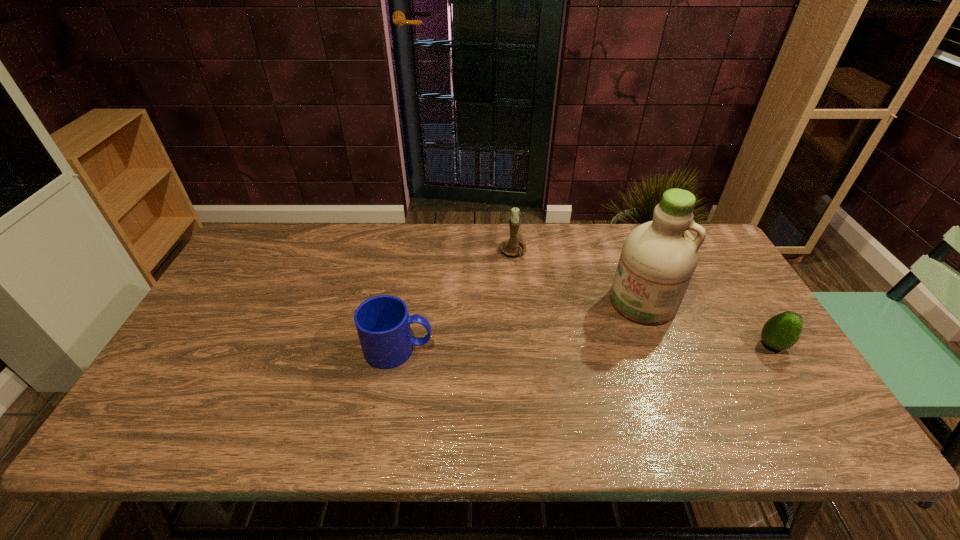
Where is `vacant space located 0.340m on the side of the candle holder with the handle`? The width and height of the screenshot is (960, 540). vacant space located 0.340m on the side of the candle holder with the handle is located at coordinates [x=552, y=344].

You are a GUI agent. You are given a task and a screenshot of the screen. Output one action in this format:
    pyautogui.click(x=<x>, y=<y>)
    Task: Click on the vacant area located on the front label of the tallest object
    The image size is (960, 540).
    Given the screenshot: What is the action you would take?
    pyautogui.click(x=588, y=371)

Find the location of `free spot located on the front label of the tallest object`. free spot located on the front label of the tallest object is located at coordinates (584, 376).

Where is `free spot located 0.140m on the front label of the tallest object`? Image resolution: width=960 pixels, height=540 pixels. free spot located 0.140m on the front label of the tallest object is located at coordinates (604, 352).

Locate an element on the screen. The height and width of the screenshot is (540, 960). object located at the far edge is located at coordinates (511, 247).

The height and width of the screenshot is (540, 960). I want to click on object that is positioned at the right edge, so point(782,331).

Where is `vacant space at the far edge of the desktop`? The image size is (960, 540). vacant space at the far edge of the desktop is located at coordinates (398, 226).

You are a GUI agent. You are given a task and a screenshot of the screen. Output one action in this format:
    pyautogui.click(x=<x>, y=<y>)
    Task: Click on the free space at the near edge of the desktop
    The image size is (960, 540).
    Given the screenshot: What is the action you would take?
    pyautogui.click(x=624, y=378)

The image size is (960, 540). I want to click on blank space at the left edge, so click(x=185, y=349).

Identify the location of free space at the near right corner of the desktop. The height and width of the screenshot is (540, 960). (785, 386).